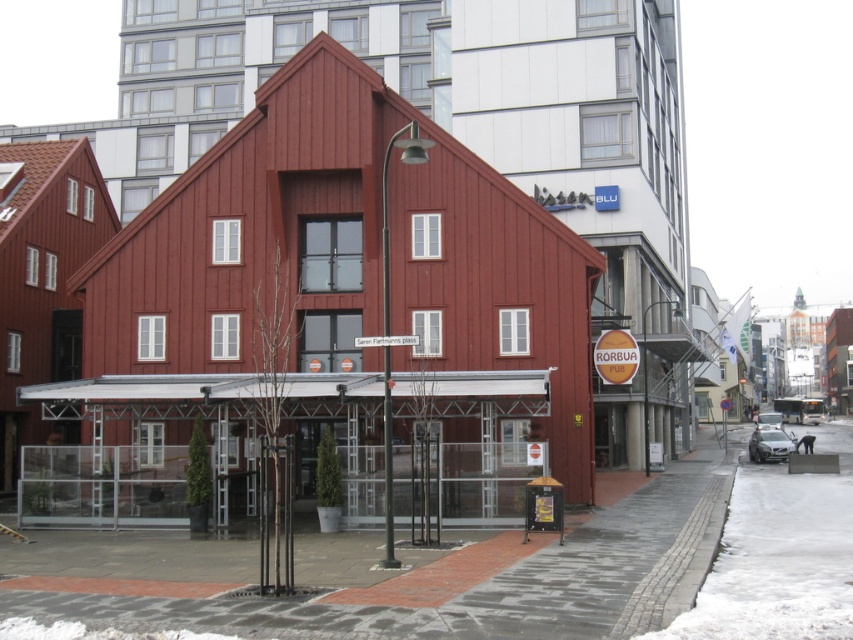
Question: Which object appears closest to the camera in this image?

Choices:
 (A) white powdery snow at lower right
 (B) brick pavement at center

Answer: (B)

Question: Is brick pavement at center in front of white powdery snow at lower right?

Choices:
 (A) yes
 (B) no

Answer: (A)

Question: Is brick pavement at center in front of white powdery snow at lower right?

Choices:
 (A) no
 (B) yes

Answer: (B)

Question: Is brick pavement at center bigger than white powdery snow at lower right?

Choices:
 (A) yes
 (B) no

Answer: (B)